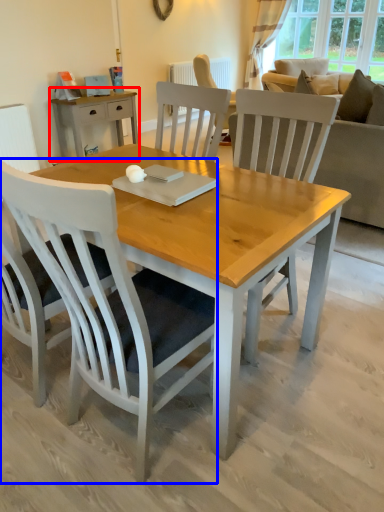
Question: Among these objects, which one is nearest to the camera, desk (highlighted by a red box) or chair (highlighted by a blue box)?

Choices:
 (A) desk
 (B) chair

Answer: (B)